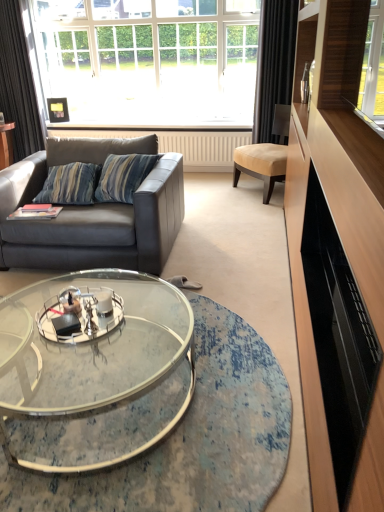
Question: Is black fabric curtain at right, placed as the second curtain when sorted from left to right, to the left or to the right of clear glass coffee table at center in the image?

Choices:
 (A) left
 (B) right

Answer: (B)

Question: Which is correct: black fabric curtain at right, the first curtain viewed from the right, is inside clear glass coffee table at center, or outside of it?

Choices:
 (A) inside
 (B) outside

Answer: (B)

Question: Which object is positioned farthest from the beige fabric chair at center?

Choices:
 (A) black fabric curtain at right, placed as the second curtain when sorted from left to right
 (B) black glossy entertainment center at right
 (C) dark gray fabric curtain at left, which ranks as the 2th curtain in right-to-left order
 (D) white textured radiator at center
 (E) leather couch at left

Answer: (C)

Question: Estimate the real-world distances between objects in this image. Which object is farther from the white textured radiator at center?

Choices:
 (A) black glossy entertainment center at right
 (B) beige fabric chair at center
 (C) clear glass coffee table at center
 (D) leather couch at left
 (E) white glass window at upper center

Answer: (C)